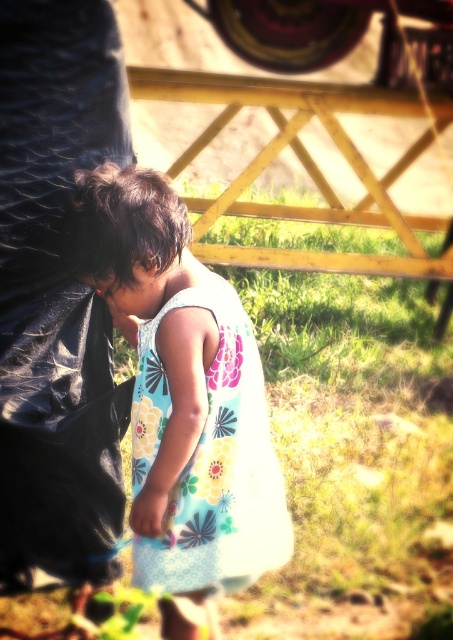
Question: Which object appears farthest from the camera in this image?

Choices:
 (A) floral fabric dress at center
 (B) floral cotton dress at center

Answer: (B)

Question: Does floral fabric dress at center have a smaller size compared to floral cotton dress at center?

Choices:
 (A) yes
 (B) no

Answer: (B)

Question: From the image, what is the correct spatial relationship of floral fabric dress at center in relation to floral cotton dress at center?

Choices:
 (A) above
 (B) below

Answer: (A)

Question: Which point appears farthest from the camera in this image?

Choices:
 (A) (221, 512)
 (B) (97, 204)

Answer: (A)

Question: Is floral fabric dress at center closer to camera compared to floral cotton dress at center?

Choices:
 (A) no
 (B) yes

Answer: (B)